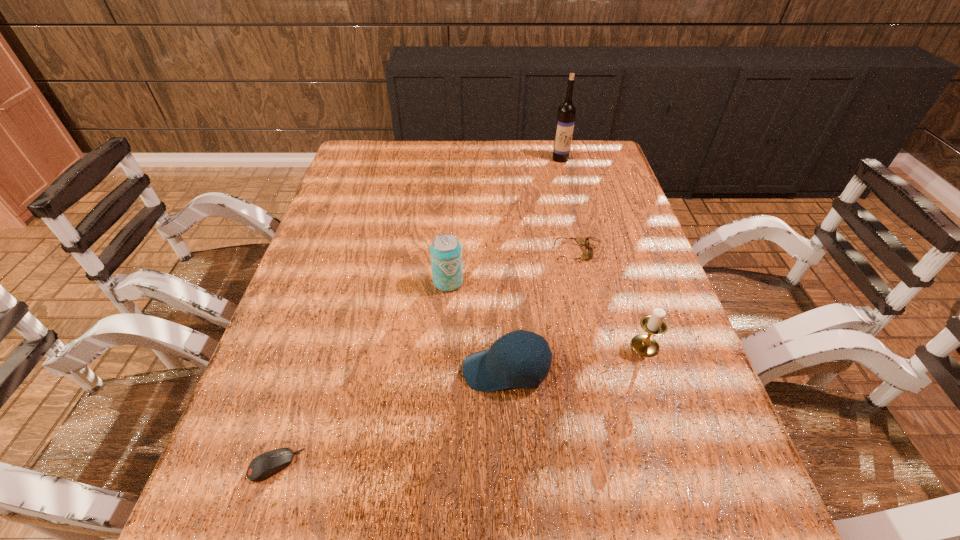
This screenshot has width=960, height=540. I want to click on the farthest object, so click(x=566, y=112).

You are a GUI agent. You are given a task and a screenshot of the screen. Output one action in this format:
    pyautogui.click(x=<x>, y=<y>)
    Task: Click on the wine bottle
    Image resolution: width=960 pixels, height=540 pixels.
    Given the screenshot: What is the action you would take?
    pyautogui.click(x=566, y=112)

Locate an element on the screen. the fifth object from right to left is located at coordinates (445, 250).

You are a GUI agent. You are given a task and a screenshot of the screen. Output one action in this format:
    pyautogui.click(x=<x>, y=<y>)
    Task: Click on the fourth nearest object
    The width and height of the screenshot is (960, 540).
    Given the screenshot: What is the action you would take?
    coord(445,250)

I want to click on candle holder, so click(654, 324).

Where is `the fourth tallest object`? The height and width of the screenshot is (540, 960). the fourth tallest object is located at coordinates (501, 367).

The height and width of the screenshot is (540, 960). I want to click on baseball cap, so click(501, 367).

The height and width of the screenshot is (540, 960). I want to click on the fifth nearest object, so click(x=581, y=241).

Where is `the second shortest object`? the second shortest object is located at coordinates (581, 241).

At what (x,y) coordinates should I click in order to perform the action: click on computer mouse. Please return your answer as a coordinate pair (x, y). This screenshot has width=960, height=540. Looking at the image, I should click on (266, 464).